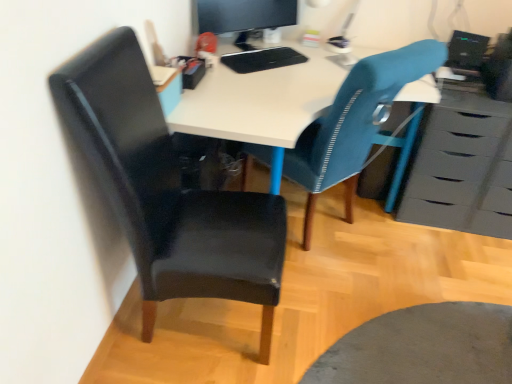
What are the coordinates of `free space underneath matte black monitor at upper center (from a real-world perspective)` in the screenshot? It's located at (248, 49).